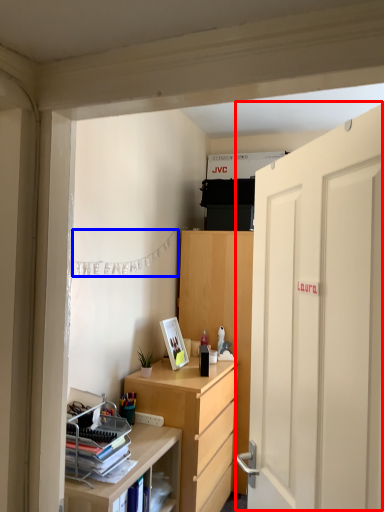
Question: Which point is closer to the camera, door (highlighted by a red box) or clothesline (highlighted by a blue box)?

Choices:
 (A) door
 (B) clothesline

Answer: (A)